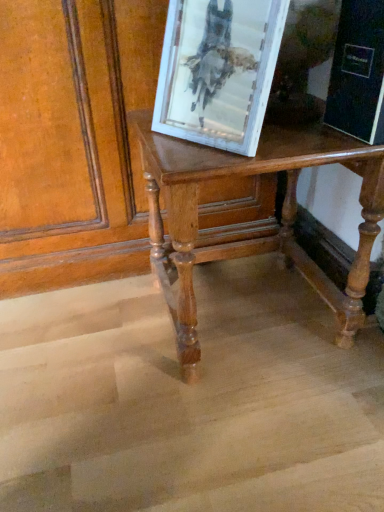
Locate an element on the screen. The image size is (384, 512). free space in front of shiny polished wood table at center is located at coordinates (240, 429).